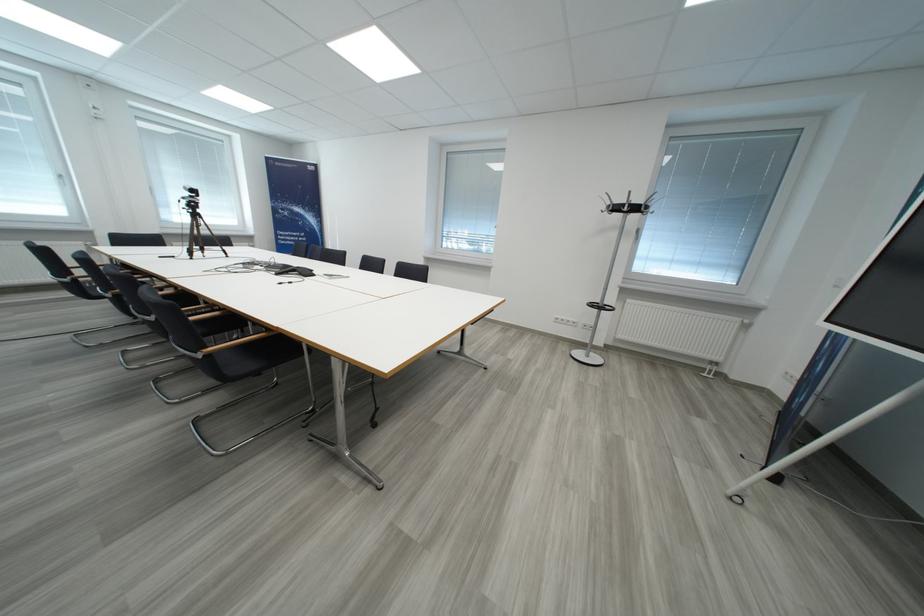
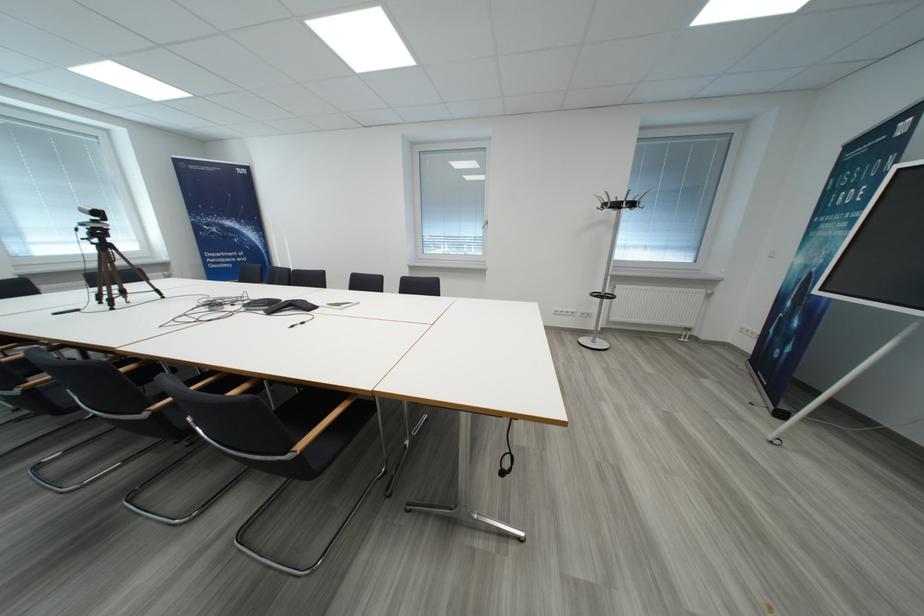
The point at (x=200, y=208) is marked in the first image. Where is the corresponding point in the second image?

(106, 236)